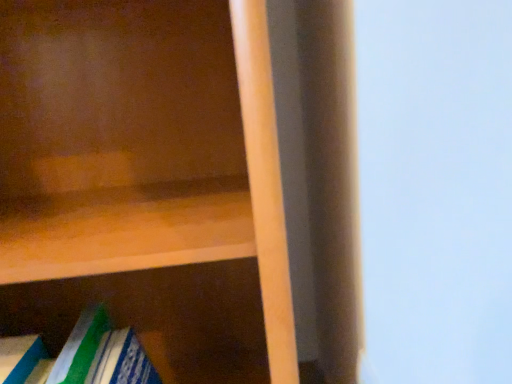
Question: Should I look upward or downward to see matte wood bookcase at lower left?

Choices:
 (A) down
 (B) up

Answer: (A)